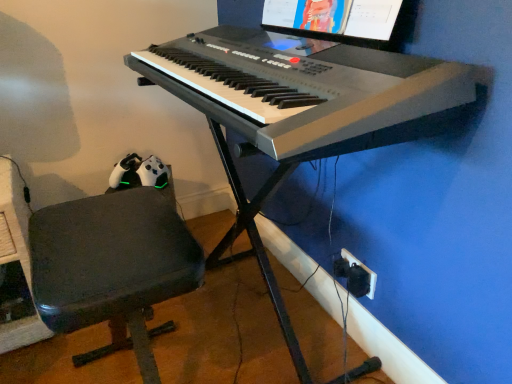
In order to click on vacant area situated below white plastic keyboard at center (from a real-world perspective) in this screenshot , I will do `click(245, 327)`.